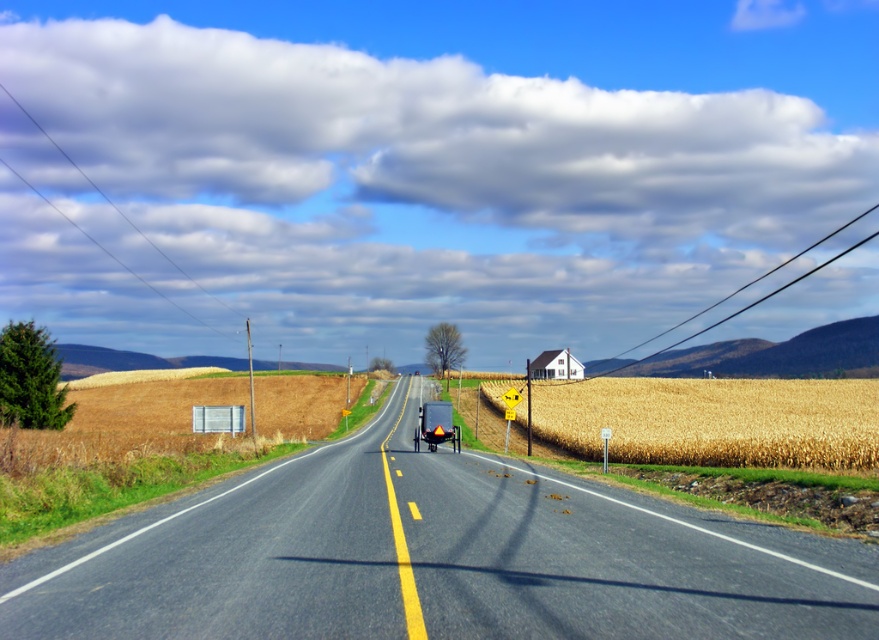
Question: Which point appears closest to the camera in this image?

Choices:
 (A) (429, 406)
 (B) (233, 492)
 (C) (851, 385)

Answer: (B)

Question: Considering the relative positions of asphalt road at center and golden grain field at right in the image provided, where is asphalt road at center located with respect to golden grain field at right?

Choices:
 (A) above
 (B) below

Answer: (A)

Question: Is golden grain field at right behind matte black trailer truck at center?

Choices:
 (A) yes
 (B) no

Answer: (B)

Question: Among these points, which one is farthest from the camera?

Choices:
 (A) (142, 534)
 (B) (638, 381)

Answer: (B)

Question: Which point is farther to the camera?

Choices:
 (A) (309, 596)
 (B) (587, 422)

Answer: (B)

Question: Is golden grain field at right smaller than matte black trailer truck at center?

Choices:
 (A) no
 (B) yes

Answer: (A)